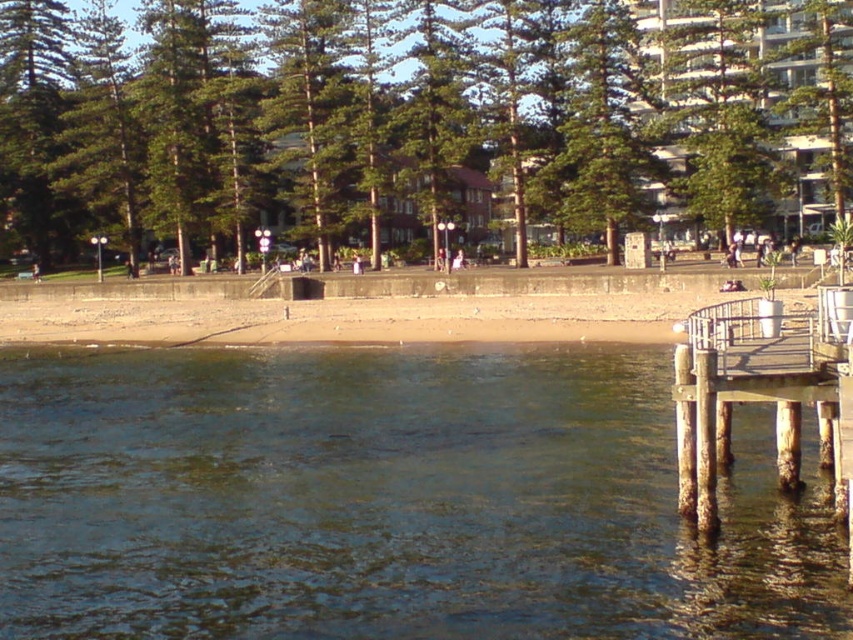
From the picture: You are standing on the beach and want to reach the clear water at lower left without walking through the green leafy tree at center. Which direction should you walk from the tree to get to the water?

You should walk to the right of the green leafy tree at center to reach the clear water at lower left because the clear water at lower left is located to the right of the green leafy tree at center.

You are standing on the beach and want to take a photo of both the clear water at lower left and the rusty wood dock at lower right. Which object should you focus on first to ensure both are in the frame?

You should focus on the clear water at lower left first because it is closer to you than the rusty wood dock at lower right, ensuring both are in the frame.